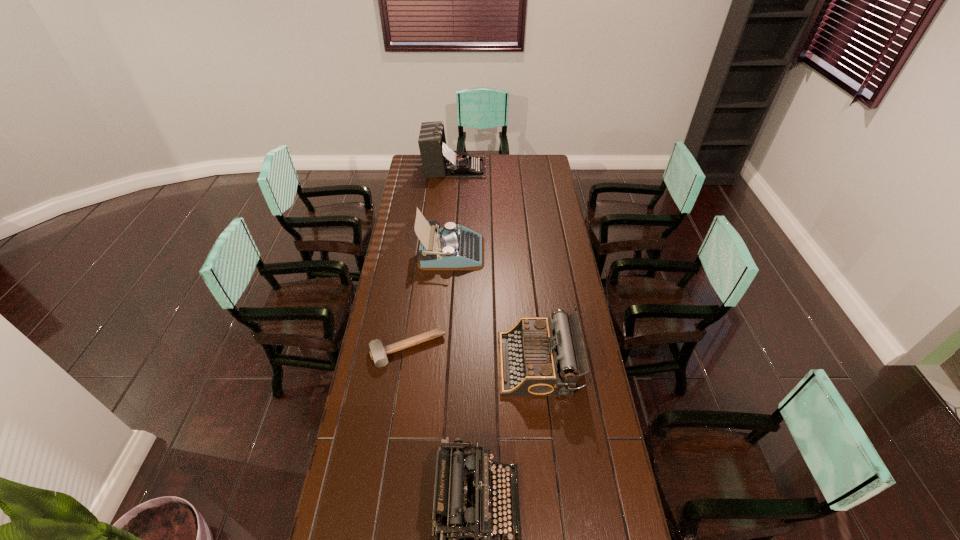
This screenshot has height=540, width=960. In order to click on the tallest typewriter in this screenshot , I will do `click(438, 160)`.

Where is `the tallest object`? This screenshot has width=960, height=540. the tallest object is located at coordinates (438, 160).

Identify the location of the second farthest object. (453, 248).

The image size is (960, 540). I want to click on the second nearest typewriter, so click(537, 357).

Identify the location of the shortest object. (378, 353).

Identify the location of vacant point located 0.120m inside the open case of the farthest typewriter. (505, 168).

At what (x,y) coordinates should I click in order to perform the action: click on vacant space located on the typing side of the second farthest typewriter. Please return your answer as a coordinate pair (x, y). This screenshot has height=540, width=960. Looking at the image, I should click on (496, 252).

Image resolution: width=960 pixels, height=540 pixels. I want to click on free space located on the keyboard of the second nearest typewriter, so click(443, 364).

At what (x,y) coordinates should I click in order to perform the action: click on vacant space positioned 0.220m on the keyboard of the second nearest typewriter. Please return your answer as a coordinate pair (x, y). Looking at the image, I should click on (443, 364).

At what (x,y) coordinates should I click in order to perform the action: click on vacant space located 0.050m on the keyboard of the second nearest typewriter. Please return your answer as a coordinate pair (x, y). Looking at the image, I should click on (486, 364).